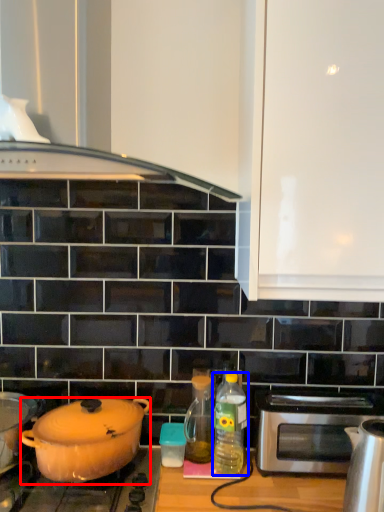
Question: Among these objects, which one is farthest to the camera, kitchen appliance (highlighted by a red box) or bottle (highlighted by a blue box)?

Choices:
 (A) kitchen appliance
 (B) bottle

Answer: (B)